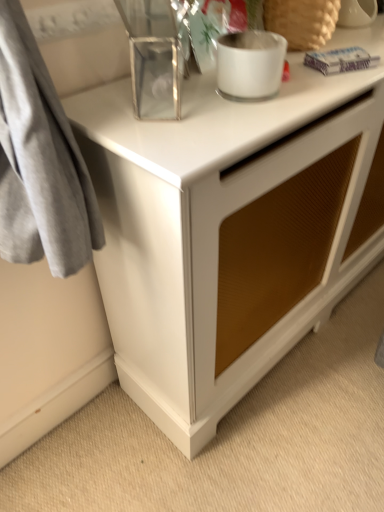
The image size is (384, 512). Find the location of `free space in front of frosted glass candle at upper center, which ranks as the second appliance in right-to-left order`. free space in front of frosted glass candle at upper center, which ranks as the second appliance in right-to-left order is located at coordinates (226, 126).